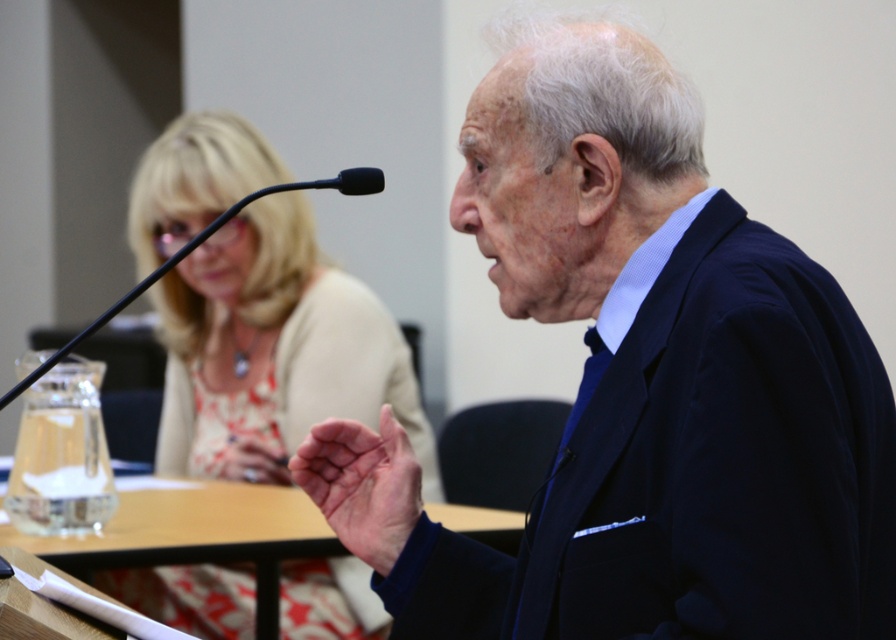
You are a photographer setting up for a formal meeting. You need to adjust the camera height so that both the clear glass table at center and the pink skin at center are in focus. Which object should you focus on first to ensure both are sharp?

The clear glass table at center is much taller than the pink skin at center, so you should focus on the clear glass table at center first to ensure both are in focus.

You are organizing a photoshoot and need to ensure that the matte beige blouse at upper left and the clear glass table at center are both visible in the frame. Given their sizes, which object should you prioritize positioning closer to the camera to maintain clarity?

The matte beige blouse at upper left is bigger than the clear glass table at center, so you should prioritize positioning the matte beige blouse at upper left closer to the camera to maintain clarity.